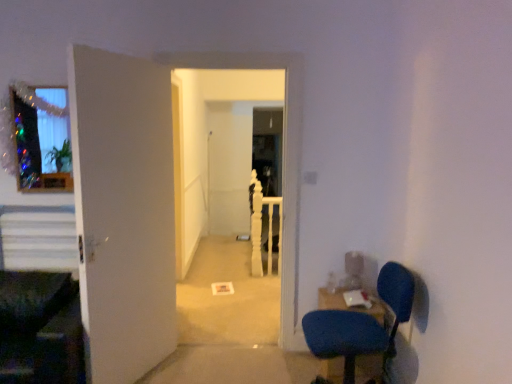
Question: From a real-world perspective, is white matte carpet at center physically located above or below white wooden rail at center?

Choices:
 (A) below
 (B) above

Answer: (B)

Question: Is white matte carpet at center bigger or smaller than white wooden rail at center?

Choices:
 (A) small
 (B) big

Answer: (B)

Question: Considering the real-world distances, which object is closest to the white matte carpet at center?

Choices:
 (A) white matte door at left
 (B) translucent glass window at upper left
 (C) white striped stairs at left
 (D) blue fabric chair at lower right
 (E) white wooden rail at center

Answer: (E)

Question: Which object is positioned closest to the white matte carpet at center?

Choices:
 (A) blue fabric chair at lower right
 (B) white matte door at left
 (C) blue fabric table at lower right
 (D) white striped stairs at left
 (E) translucent glass window at upper left

Answer: (E)